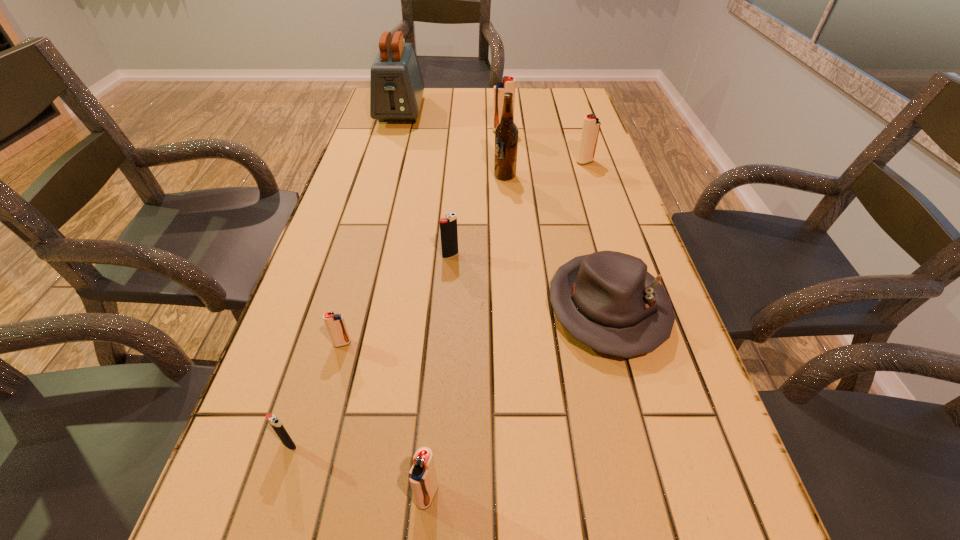
In order to click on hat in this screenshot , I will do `click(607, 300)`.

I want to click on the third farthest red igniter, so click(335, 323).

Where is `the leftmost red igniter`? The image size is (960, 540). the leftmost red igniter is located at coordinates coord(335,323).

Find the location of a particular element. This screenshot has height=540, width=960. the leftmost igniter is located at coordinates (274, 421).

Locate an element on the screen. The width and height of the screenshot is (960, 540). the left black igniter is located at coordinates (274, 421).

I want to click on free space located 0.210m on the front-facing side of the toaster, so click(x=386, y=161).

Where is `free spot located 0.150m on the label of the sixth nearest object`? This screenshot has width=960, height=540. free spot located 0.150m on the label of the sixth nearest object is located at coordinates (443, 176).

The width and height of the screenshot is (960, 540). Identify the location of vacant space located 0.260m on the label of the sixth nearest object. (405, 176).

Where is `vacant space situated 0.050m on the label of the sixth nearest object`? The image size is (960, 540). vacant space situated 0.050m on the label of the sixth nearest object is located at coordinates (477, 176).

In order to click on vacant space positioned 0.150m on the back of the third red igniter from left to right in this screenshot , I will do `click(501, 110)`.